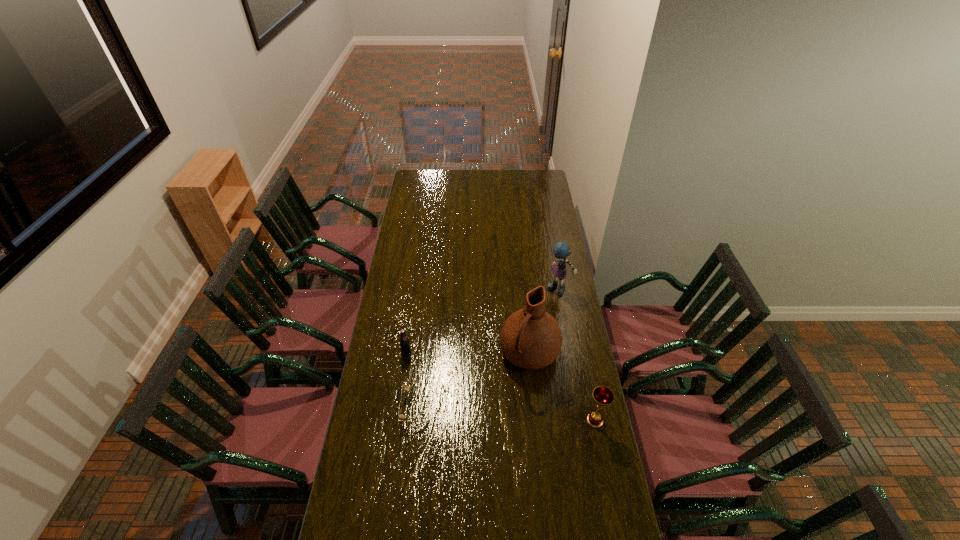
In order to click on the shortest object in this screenshot , I will do `click(401, 417)`.

Where is `chalice`? chalice is located at coordinates (603, 396).

I want to click on pitcher, so click(x=530, y=338).

You are a GUI agent. You are given a task and a screenshot of the screen. Output one action in this format:
    pyautogui.click(x=<x>, y=<y>)
    Task: Click on the farthest object
    
    Given the screenshot: What is the action you would take?
    pyautogui.click(x=561, y=250)

Image resolution: width=960 pixels, height=540 pixels. Find the location of `the second tallest object`. the second tallest object is located at coordinates (561, 250).

At what (x,y) coordinates should I click in order to perform the action: click on the second shortest object. Please return your answer as a coordinate pair (x, y). The image size is (960, 540). Looking at the image, I should click on (404, 342).

The image size is (960, 540). What are the coordinates of `free region located on the front lenses of the sunglasses` in the screenshot? It's located at (382, 408).

Where is `vacant space located on the left of the chalice`? vacant space located on the left of the chalice is located at coordinates (554, 420).

Identify the location of free space located 0.230m on the side of the tallest object with the handle. The height and width of the screenshot is (540, 960). (489, 419).

Where is `free space located on the side of the tallest object with the handle`? free space located on the side of the tallest object with the handle is located at coordinates (479, 436).